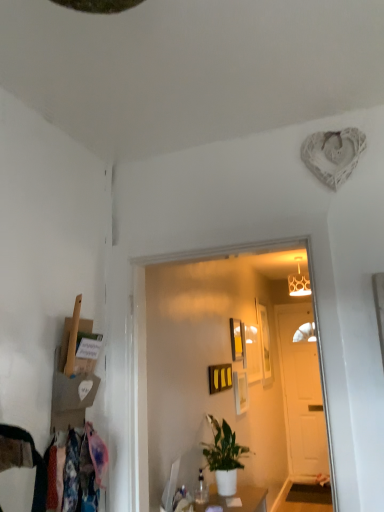
Image resolution: width=384 pixels, height=512 pixels. I want to click on yellow matte picture frame at center, the first picture frame from the front, so click(220, 377).

What do you see at coordinates (224, 456) in the screenshot?
I see `green matte plant at center` at bounding box center [224, 456].

Image resolution: width=384 pixels, height=512 pixels. What do you see at coordinates (264, 343) in the screenshot? I see `wooden picture frame at center, arranged as the 1th picture frame when viewed from the back` at bounding box center [264, 343].

This screenshot has width=384, height=512. What are the coordinates of `matte gold lampshade at upper center` in the screenshot? It's located at (299, 282).

In order to click on yellow matte picture frame at center, which is counted as the 5th picture frame, starting from the back in this screenshot , I will do `click(220, 377)`.

How different are the orientations of wooden picture frame at center, which is the 5th picture frame from front to back, and matte white picture frame at upper center, which is the 4th picture frame from front to back, in degrees?

The angular difference between wooden picture frame at center, which is the 5th picture frame from front to back, and matte white picture frame at upper center, which is the 4th picture frame from front to back, is 0.000184 degrees.

In the image, is wooden picture frame at center, arranged as the 1th picture frame when viewed from the back, positioned in front of or behind matte white picture frame at upper center, which appears as the 2th picture frame when viewed from the back?

In the image, wooden picture frame at center, arranged as the 1th picture frame when viewed from the back, appears behind matte white picture frame at upper center, which appears as the 2th picture frame when viewed from the back.

In terms of size, does wooden picture frame at center, arranged as the 1th picture frame when viewed from the back, appear bigger or smaller than matte white picture frame at upper center, which appears as the 2th picture frame when viewed from the back?

In the image, wooden picture frame at center, arranged as the 1th picture frame when viewed from the back, appears to be larger than matte white picture frame at upper center, which appears as the 2th picture frame when viewed from the back.

From the image's perspective, is wooden picture frame at center, which is the 5th picture frame from front to back, located beneath matte white picture frame at upper center, which is the 4th picture frame from front to back?

Yes, from the image's perspective, wooden picture frame at center, which is the 5th picture frame from front to back, is below matte white picture frame at upper center, which is the 4th picture frame from front to back.

Is floral fabric laundry at lower left beside matte black picture frame at center, the 3th picture frame when ordered from front to back?

No, floral fabric laundry at lower left is not beside matte black picture frame at center, the 3th picture frame when ordered from front to back.

From a real-world perspective, is floral fabric laundry at lower left positioned under matte black picture frame at center, the 3th picture frame when ordered from front to back, based on gravity?

Indeed, from a real-world perspective, floral fabric laundry at lower left is positioned beneath matte black picture frame at center, the 3th picture frame when ordered from front to back.

Which picture frame is the 2nd one when counting from the right side of the floral fabric laundry at lower left? Please provide its 2D coordinates.

[(237, 339)]

Is floral fabric laundry at lower left to the left or to the right of matte black picture frame at center, which ranks as the 3th picture frame in back-to-front order, in the image?

From the image, it's evident that floral fabric laundry at lower left is to the left of matte black picture frame at center, which ranks as the 3th picture frame in back-to-front order.

Which is closer, [225,366] or [301,295]?

Point [225,366]

Is yellow matte picture frame at center, the first picture frame from the front, bigger than matte gold lampshade at upper center?

No.

Is yellow matte picture frame at center, the first picture frame from the front, completely or partially outside of matte gold lampshade at upper center?

Indeed, yellow matte picture frame at center, the first picture frame from the front, is completely outside matte gold lampshade at upper center.

Is yellow matte picture frame at center, the first picture frame from the front, looking in the opposite direction of matte gold lampshade at upper center?

No, yellow matte picture frame at center, the first picture frame from the front, is not facing away from matte gold lampshade at upper center.

Which object is wider, white wooden door at center or matte black picture frame at center, acting as the second picture frame starting from the front?

With larger width is white wooden door at center.

Is white wooden door at center not close to matte black picture frame at center, acting as the second picture frame starting from the front?

Yes, white wooden door at center and matte black picture frame at center, acting as the second picture frame starting from the front, are located far from each other.

Is the position of white wooden door at center more distant than that of matte black picture frame at center, marked as the fourth picture frame in a back-to-front arrangement?

Yes, white wooden door at center is further from the camera.

From the matte black picture frame at center, acting as the second picture frame starting from the front, count 1st picture frames backward and point to it. Please provide its 2D coordinates.

[(237, 339)]

Between matte black picture frame at center, which ranks as the 3th picture frame in back-to-front order, and matte black picture frame at center, acting as the second picture frame starting from the front, which one appears on the right side from the viewer's perspective?

Positioned to the right is matte black picture frame at center, acting as the second picture frame starting from the front.

Considering the positions of points (233, 331) and (242, 399), is point (233, 331) closer to camera compared to point (242, 399)?

Yes, point (233, 331) is closer to viewer.

From a real-world perspective, between matte black picture frame at center, which ranks as the 3th picture frame in back-to-front order, and matte black picture frame at center, marked as the fourth picture frame in a back-to-front arrangement, who is vertically lower?

matte black picture frame at center, marked as the fourth picture frame in a back-to-front arrangement, from a real-world perspective.

Is point (242, 390) in front of point (263, 347)?

Yes.

Looking at this image, is wooden picture frame at center, which is the 5th picture frame from front to back, at the back of matte black picture frame at center, marked as the fourth picture frame in a back-to-front arrangement?

No, matte black picture frame at center, marked as the fourth picture frame in a back-to-front arrangement, is not facing away from wooden picture frame at center, which is the 5th picture frame from front to back.

Are matte black picture frame at center, acting as the second picture frame starting from the front, and wooden picture frame at center, arranged as the 1th picture frame when viewed from the back, located far from each other?

No, matte black picture frame at center, acting as the second picture frame starting from the front, is not far from wooden picture frame at center, arranged as the 1th picture frame when viewed from the back.

From a real-world perspective, which picture frame is the 3rd one underneath the matte gold lampshade at upper center? Please provide its 2D coordinates.

[(253, 353)]

Which of these two, matte gold lampshade at upper center or matte white picture frame at upper center, which appears as the 2th picture frame when viewed from the back, stands taller?

With more height is matte white picture frame at upper center, which appears as the 2th picture frame when viewed from the back.

From a real-world perspective, between matte gold lampshade at upper center and matte white picture frame at upper center, which appears as the 2th picture frame when viewed from the back, who is vertically higher?

In real-world perspective, matte gold lampshade at upper center is above.

Identify the location of picture frame that appears on the right of matte white picture frame at upper center, which is the 4th picture frame from front to back. This screenshot has height=512, width=384. (264, 343).

This screenshot has width=384, height=512. In the image, there is a matte black picture frame at center, which ranks as the 3th picture frame in back-to-front order. In order to click on laundry below it (from a real-world perspective) in this screenshot , I will do `click(76, 472)`.

Looking at this image, estimate the real-world distances between objects in this image. Which object is closer to floral fabric laundry at lower left, green matte plant at center or white wooden door at center?

green matte plant at center is closer to floral fabric laundry at lower left.

Which object lies nearer to the anchor point matte black picture frame at center, marked as the fourth picture frame in a back-to-front arrangement, floral fabric laundry at lower left or matte white picture frame at upper center, which appears as the 2th picture frame when viewed from the back?

Among the two, matte white picture frame at upper center, which appears as the 2th picture frame when viewed from the back, is located nearer to matte black picture frame at center, marked as the fourth picture frame in a back-to-front arrangement.

From the image, which object appears to be nearer to floral fabric laundry at lower left, matte gold lampshade at upper center or white wooden door at center?

matte gold lampshade at upper center is closer to floral fabric laundry at lower left.

Based on their spatial positions, is yellow matte picture frame at center, the first picture frame from the front, or matte black picture frame at center, which ranks as the 3th picture frame in back-to-front order, closer to floral fabric laundry at lower left?

yellow matte picture frame at center, the first picture frame from the front, is positioned closer to the anchor floral fabric laundry at lower left.

Considering their positions, is matte white picture frame at upper center, which appears as the 2th picture frame when viewed from the back, positioned further to wooden picture frame at center, arranged as the 1th picture frame when viewed from the back, than matte black picture frame at center, which ranks as the 3th picture frame in back-to-front order?

matte black picture frame at center, which ranks as the 3th picture frame in back-to-front order, is further to wooden picture frame at center, arranged as the 1th picture frame when viewed from the back.

Based on their spatial positions, is matte white picture frame at upper center, which appears as the 2th picture frame when viewed from the back, or matte black picture frame at center, which ranks as the 3th picture frame in back-to-front order, further from matte gold lampshade at upper center?

The object further to matte gold lampshade at upper center is matte black picture frame at center, which ranks as the 3th picture frame in back-to-front order.

Consider the image. When comparing their distances from wooden picture frame at center, which is the 5th picture frame from front to back, does floral fabric laundry at lower left or matte black picture frame at center, acting as the second picture frame starting from the front, seem closer?

Among the two, matte black picture frame at center, acting as the second picture frame starting from the front, is located nearer to wooden picture frame at center, which is the 5th picture frame from front to back.

Considering their positions, is green matte plant at center positioned further to matte black picture frame at center, marked as the fourth picture frame in a back-to-front arrangement, than white wooden door at center?

white wooden door at center is further to matte black picture frame at center, marked as the fourth picture frame in a back-to-front arrangement.

At what (x,y) coordinates should I click in order to perform the action: click on picture frame between green matte plant at center and matte black picture frame at center, marked as the fourth picture frame in a back-to-front arrangement, in the front-back direction. Please return your answer as a coordinate pair (x, y). Image resolution: width=384 pixels, height=512 pixels. Looking at the image, I should click on (220, 377).

Find the location of a particular element. Image resolution: width=384 pixels, height=512 pixels. lamp between green matte plant at center and wooden picture frame at center, which is the 5th picture frame from front to back, from front to back is located at coordinates (299, 282).

Find the location of a particular element. picture frame positioned between matte black picture frame at center, which ranks as the 3th picture frame in back-to-front order, and wooden picture frame at center, arranged as the 1th picture frame when viewed from the back, from near to far is located at coordinates (253, 353).

This screenshot has height=512, width=384. I want to click on picture frame between yellow matte picture frame at center, which is counted as the 5th picture frame, starting from the back, and matte black picture frame at center, the 3th picture frame when ordered from front to back, from front to back, so click(x=240, y=391).